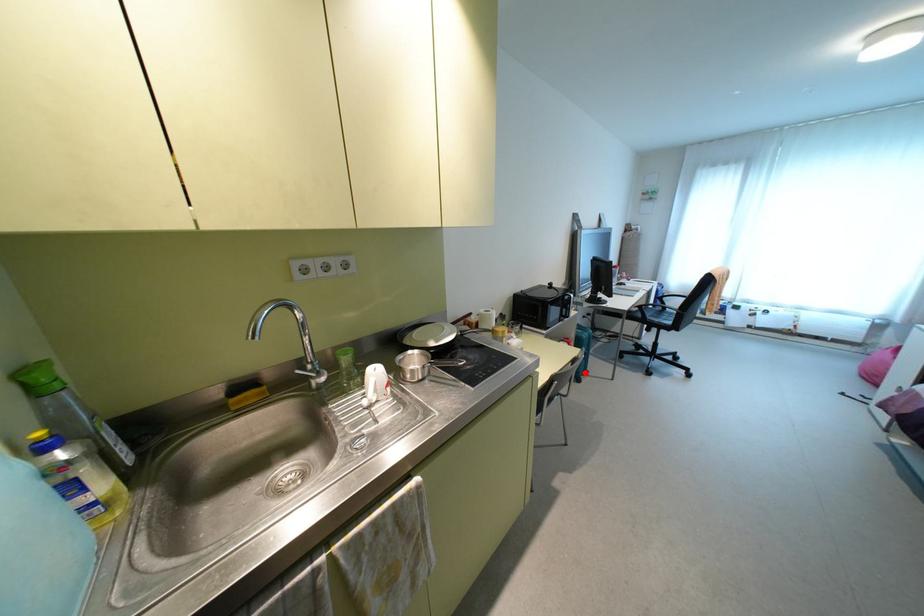
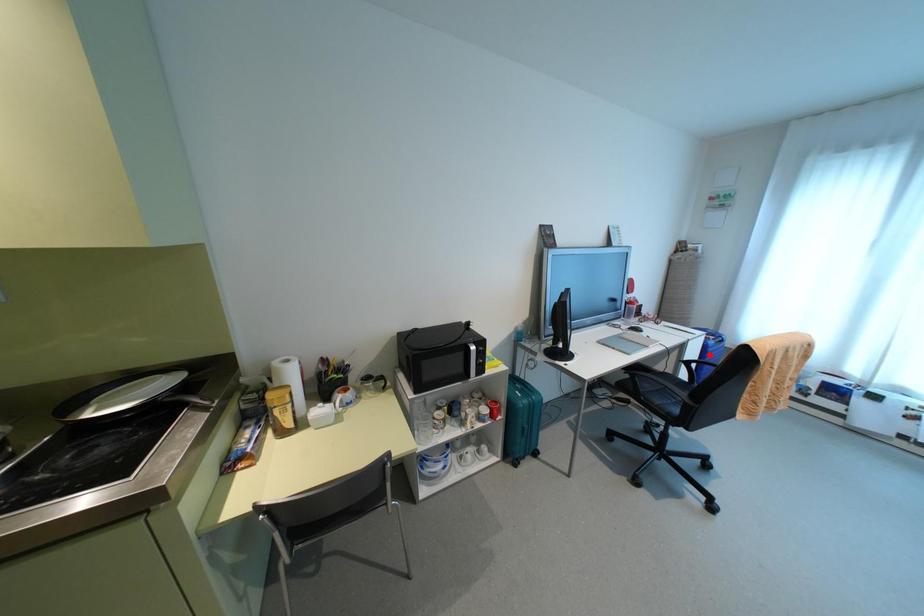
I am providing you with two images of the same scene from different viewpoints. A red point is marked on the first image and another point is marked on the second image. Do the highlighted points in image1 and image2 indicate the same real-world spot?

No